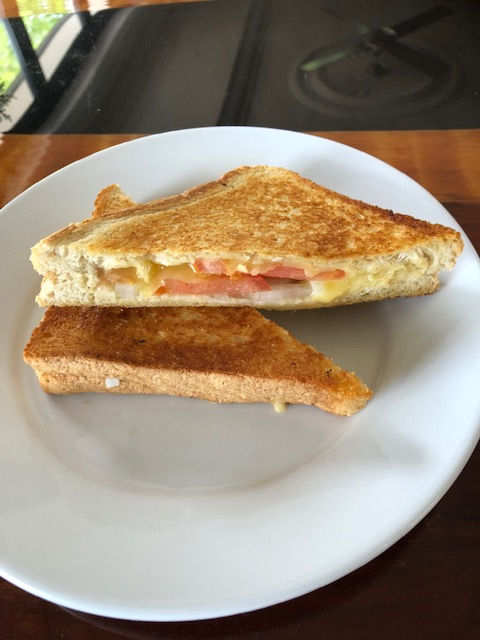
Find the location of a particular element. ceiling fan is located at coordinates (385, 42).